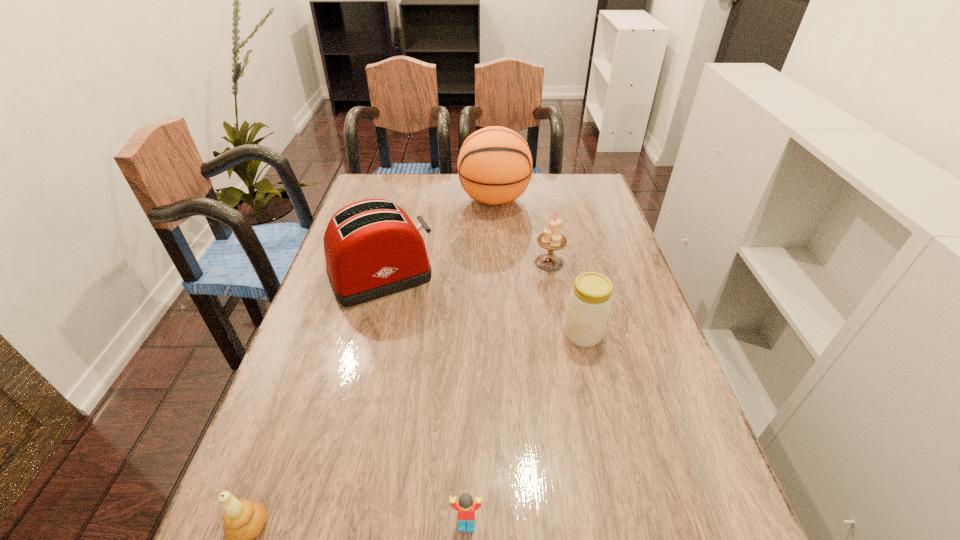
Where is `the farthest object`? The image size is (960, 540). the farthest object is located at coordinates (494, 165).

Locate an element on the screen. The width and height of the screenshot is (960, 540). basketball is located at coordinates (494, 165).

Where is `the fifth shortest object`? the fifth shortest object is located at coordinates (372, 249).

The width and height of the screenshot is (960, 540). Identify the location of jar. (590, 300).

The width and height of the screenshot is (960, 540). Identify the location of the farther candle_holder. (551, 240).

The height and width of the screenshot is (540, 960). Find the location of `the taller candle_holder`. the taller candle_holder is located at coordinates (551, 240).

Identify the location of Lego. (466, 508).

Where is `vacant area situated on the left of the tallest object`? The image size is (960, 540). vacant area situated on the left of the tallest object is located at coordinates (416, 199).

In order to click on vacant space located 0.280m on the right of the toaster in this screenshot , I will do `click(534, 276)`.

Locate an element on the screen. free spot located 0.250m on the left of the fourth farthest object is located at coordinates (460, 334).